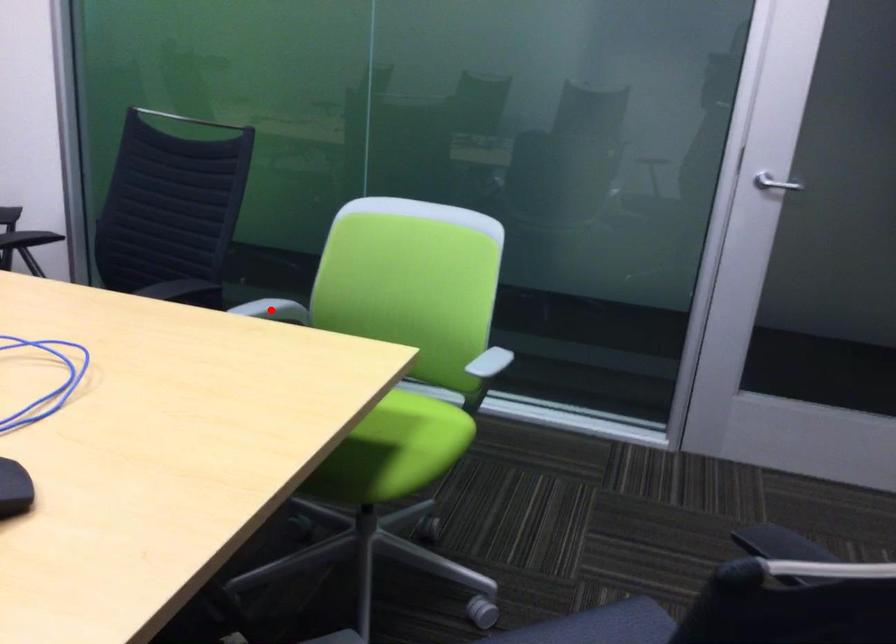
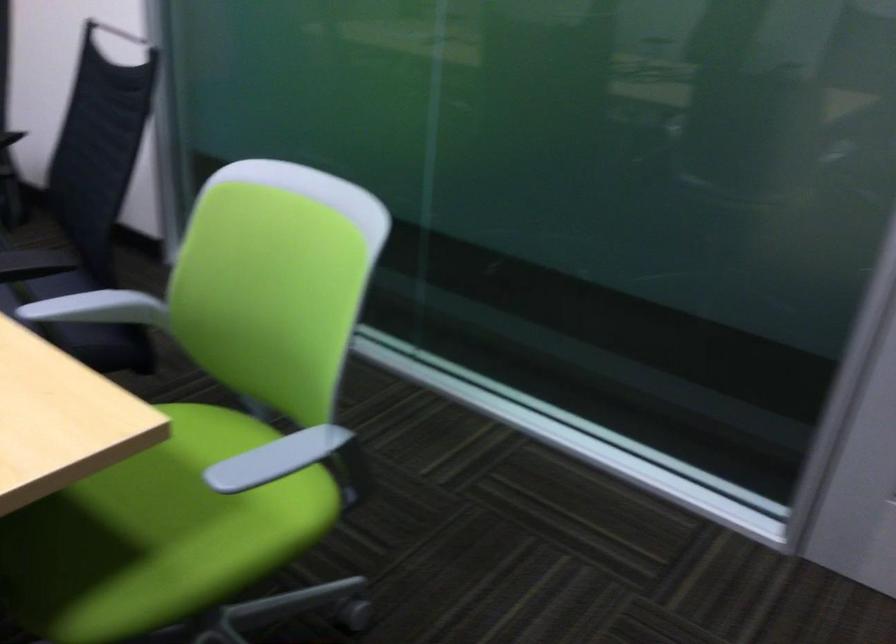
Question: I am providing you with two images of the same scene from different viewpoints. Image1 has a red point marked. In image2, the corresponding 3D location appears at what relative position? Reply with the corresponding letter.

Choices:
 (A) Closer
 (B) Farther

Answer: (A)